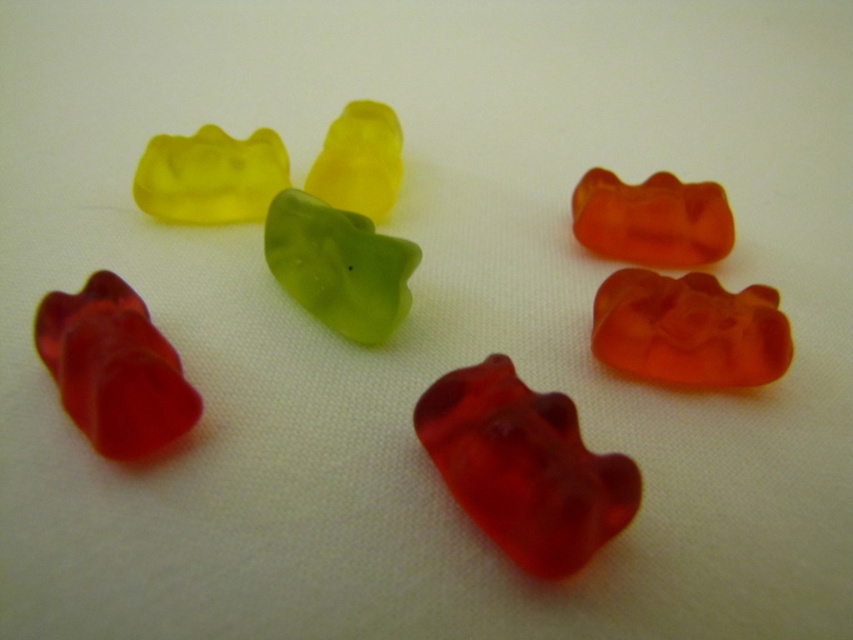
Question: Can you confirm if translucent red gummy bear at lower left is thinner than yellow translucent bear at upper left?

Choices:
 (A) yes
 (B) no

Answer: (A)

Question: Among these objects, which one is nearest to the camera?

Choices:
 (A) yellow translucent bear at upper left
 (B) translucent amber gummy bear at upper right
 (C) green translucent gummy bear at center
 (D) translucent red gummy bear at center

Answer: (D)

Question: Among these points, which one is farthest from the camera?

Choices:
 (A) (254, 131)
 (B) (590, 340)
 (C) (358, 339)
 (D) (338, 172)

Answer: (A)

Question: Which point is closer to the camera?

Choices:
 (A) (318, 186)
 (B) (589, 470)

Answer: (B)

Question: Can you confirm if translucent orange gummy bear at center right is wider than translucent yellow gummy bear at center?

Choices:
 (A) yes
 (B) no

Answer: (A)

Question: Is translucent orange gummy bear at center right smaller than green translucent gummy bear at center?

Choices:
 (A) no
 (B) yes

Answer: (B)